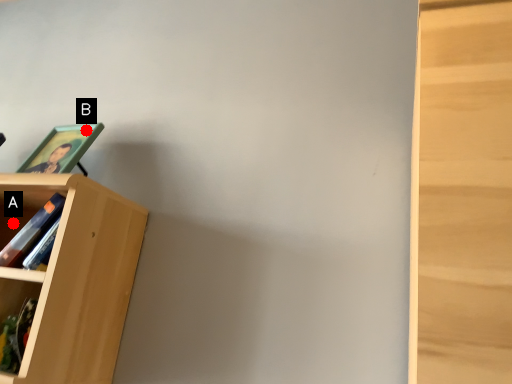
Question: Two points are circled on the image, labeled by A and B beside each circle. Which point is closer to the camera?

Choices:
 (A) A is closer
 (B) B is closer

Answer: (B)